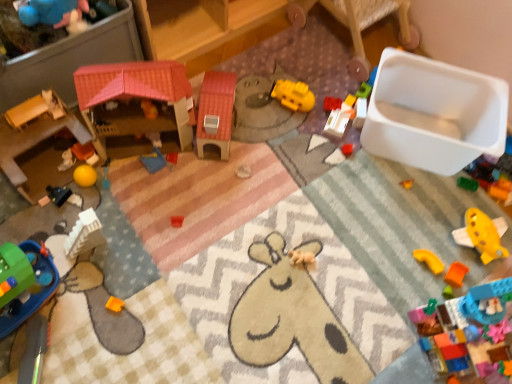
Locate an element on the screen. This screenshot has height=384, width=512. free space to the left of orange matte block at lower right, acting as the 14th toy starting from the left is located at coordinates (402, 273).